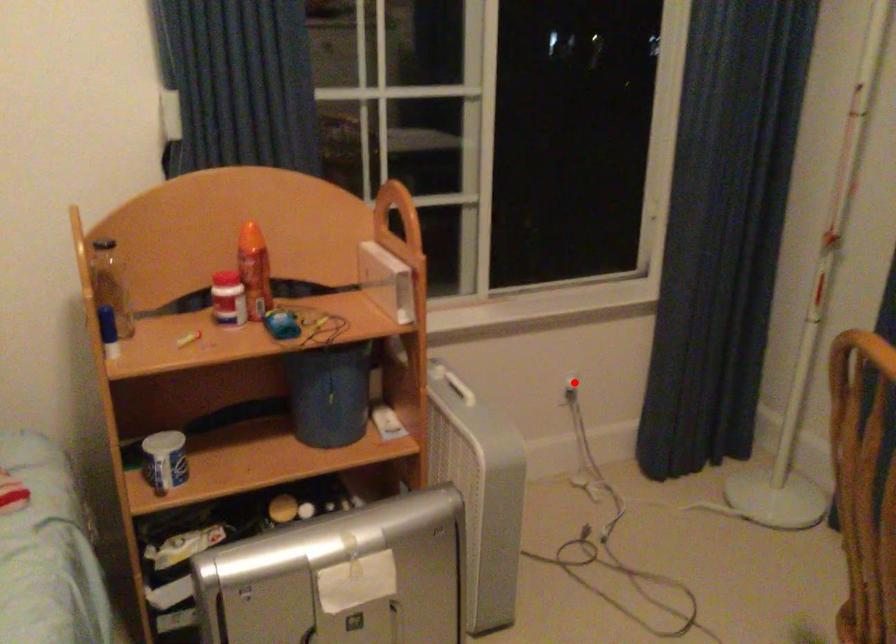
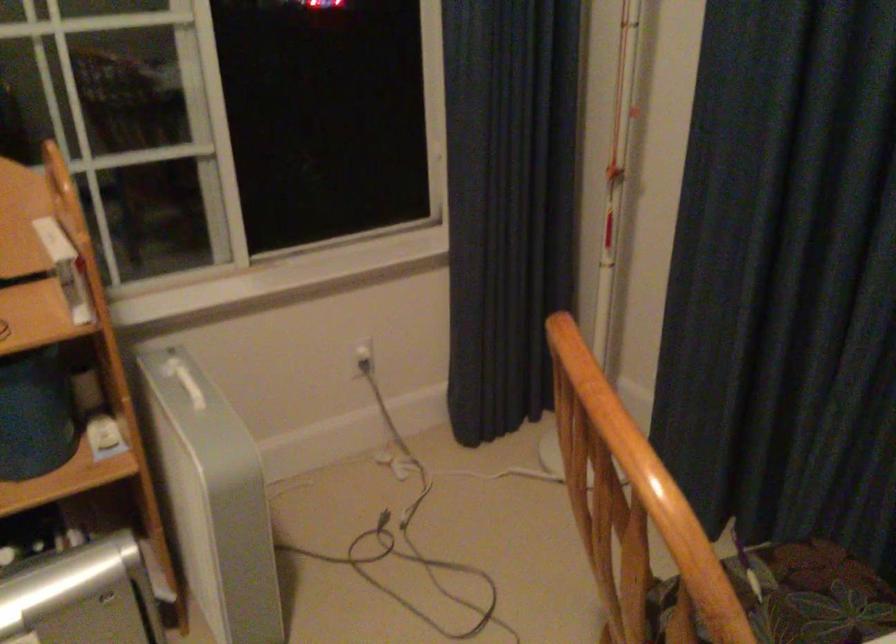
Question: A red point is marked in image1. In image2, is the corresponding 3D point closer to the camera or farther? Reply with the corresponding letter.

Choices:
 (A) The corresponding 3D point is closer.
 (B) The corresponding 3D point is farther.

Answer: (A)